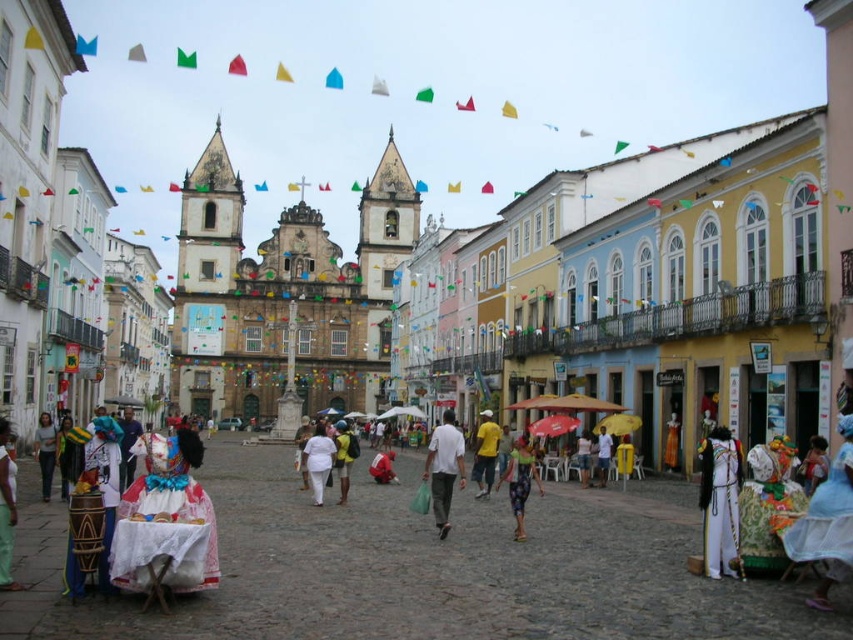
Question: Which object is closer to the camera taking this photo?

Choices:
 (A) multicolored fabric dress at center
 (B) white matte shirt at center
 (C) white matte costume at lower right

Answer: (C)

Question: Considering the relative positions of white matte costume at lower right and yellow matte shirt at center in the image provided, where is white matte costume at lower right located with respect to yellow matte shirt at center?

Choices:
 (A) above
 (B) below

Answer: (A)

Question: Is white matte costume at lower right wider than white matte shirt at center?

Choices:
 (A) no
 (B) yes

Answer: (B)

Question: Estimate the real-world distances between objects in this image. Which object is closer to the yellow matte shirt at center?

Choices:
 (A) white matte shirt at center
 (B) white cotton dress at center
 (C) white matte costume at lower right
 (D) multicolored fabric dress at center

Answer: (A)

Question: Does white cotton dress at center have a lesser width compared to yellow matte shirt at center?

Choices:
 (A) no
 (B) yes

Answer: (A)

Question: Estimate the real-world distances between objects in this image. Which object is farther from the yellow matte shirt at center?

Choices:
 (A) white cotton dress at center
 (B) white matte costume at lower right
 (C) white matte shirt at center

Answer: (B)